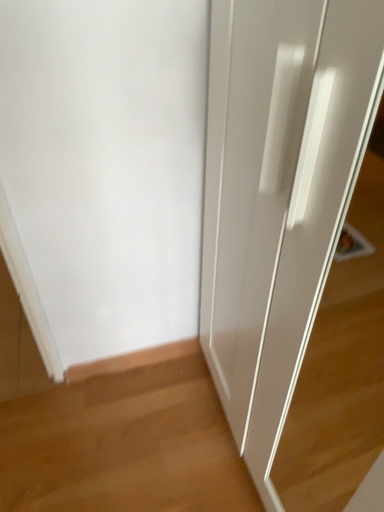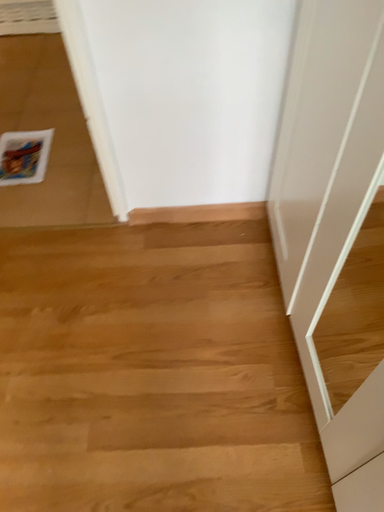
Question: Which way did the camera rotate in the video?

Choices:
 (A) rotated right
 (B) rotated left

Answer: (B)